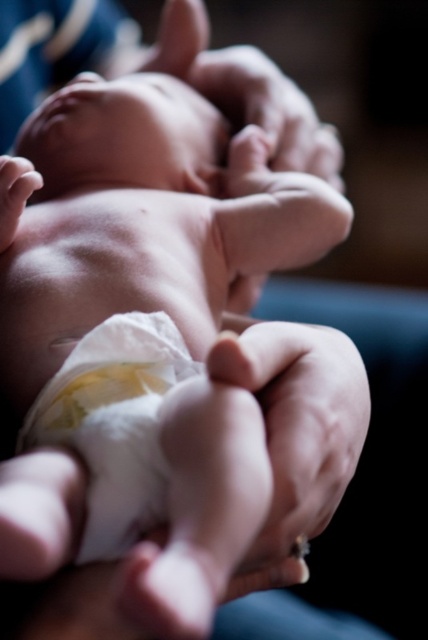
Question: Which of the following is the closest to the observer?

Choices:
 (A) white soft diaper at center
 (B) smooth skin hand at lower left
 (C) smooth skin hand at center

Answer: (A)

Question: Can you confirm if smooth skin hand at center is bigger than smooth skin hand at lower left?

Choices:
 (A) no
 (B) yes

Answer: (B)

Question: Which point is farther to the camera?

Choices:
 (A) (332, 160)
 (B) (180, 337)

Answer: (A)

Question: Is white soft diaper at center thinner than smooth skin hand at lower left?

Choices:
 (A) no
 (B) yes

Answer: (A)

Question: Is white soft diaper at center thinner than smooth skin hand at center?

Choices:
 (A) yes
 (B) no

Answer: (A)

Question: Among these points, which one is farthest from the camera?

Choices:
 (A) (3, 172)
 (B) (162, 392)
 (C) (278, 108)

Answer: (C)